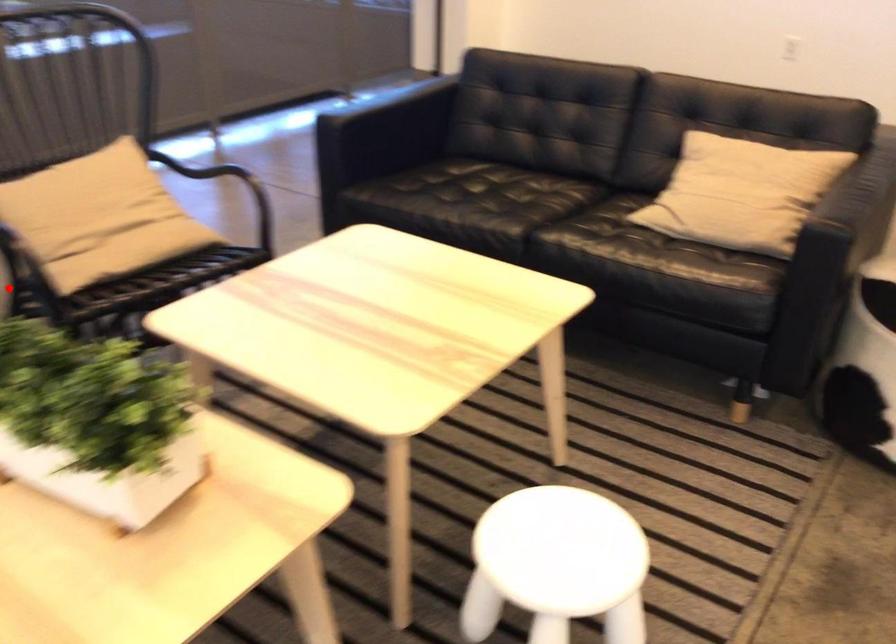
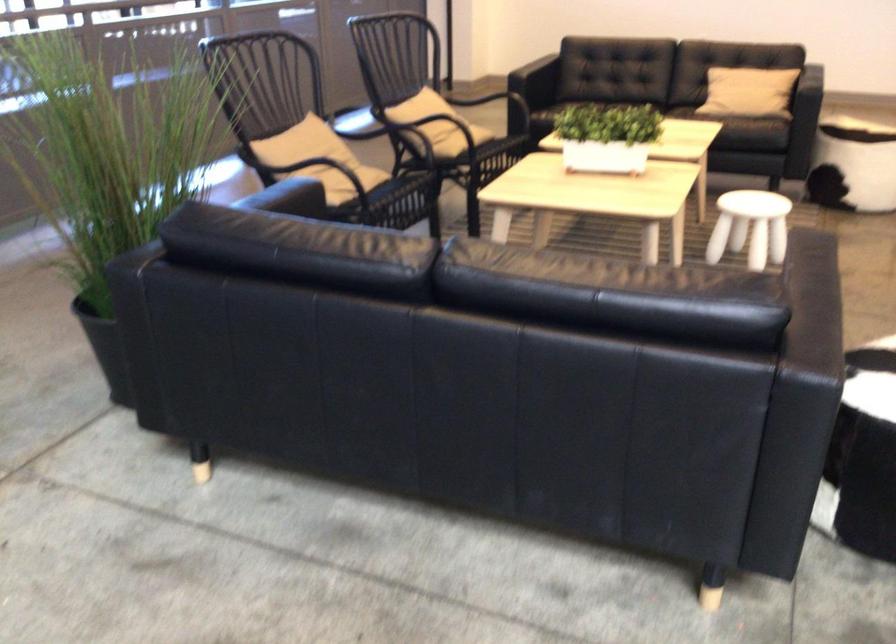
Question: I am providing you with two images of the same scene from different viewpoints. A red point is marked on the first image. Is the red point's position out of view in image 2?

Choices:
 (A) Yes
 (B) No

Answer: (A)